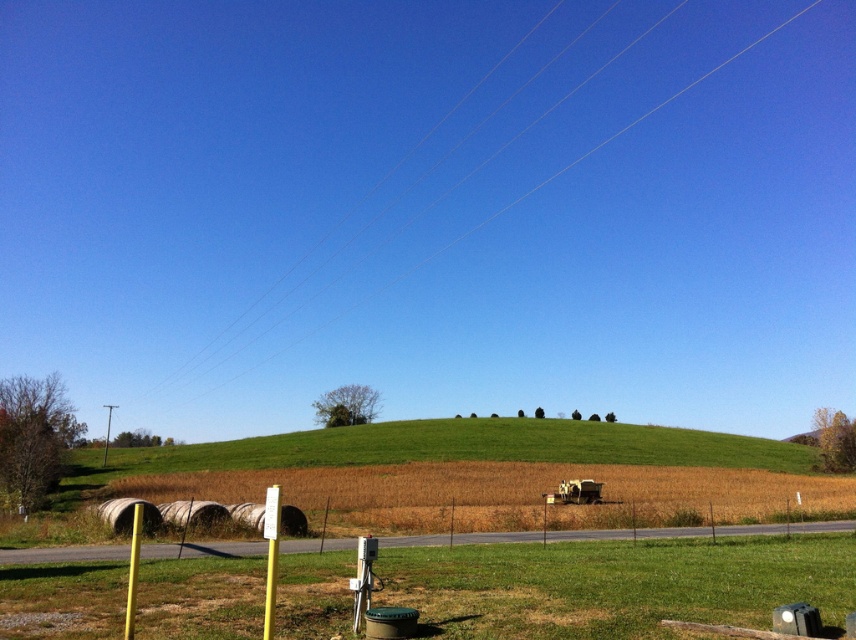
Can you confirm if green grassy hill at center is positioned to the left of yellow matte pole at lower left?

Incorrect, green grassy hill at center is not on the left side of yellow matte pole at lower left.

Is the position of green grassy hill at center more distant than that of yellow matte pole at lower left?

Yes.

Which is behind, point (293, 456) or point (128, 604)?

The point (293, 456) is behind.

The height and width of the screenshot is (640, 856). What are the coordinates of `green grassy hill at center` in the screenshot? It's located at click(458, 448).

The width and height of the screenshot is (856, 640). What do you see at coordinates (458, 448) in the screenshot?
I see `green grassy hill at center` at bounding box center [458, 448].

Does green grassy hill at center have a larger size compared to clear blue sky at upper center?

No, green grassy hill at center is not bigger than clear blue sky at upper center.

Does point (200, 467) lie behind point (587, 77)?

No, it is in front of (587, 77).

In order to click on green grassy hill at center in this screenshot , I will do `click(458, 448)`.

Between clear blue sky at upper center and yellow matte pole at lower left, which one is positioned lower?

Positioned lower is yellow matte pole at lower left.

Based on the photo, between clear blue sky at upper center and yellow matte pole at lower left, which one appears on the left side from the viewer's perspective?

yellow matte pole at lower left is more to the left.

Which is in front, point (563, 166) or point (128, 634)?

Point (128, 634) is more forward.

This screenshot has height=640, width=856. I want to click on clear blue sky at upper center, so click(521, 195).